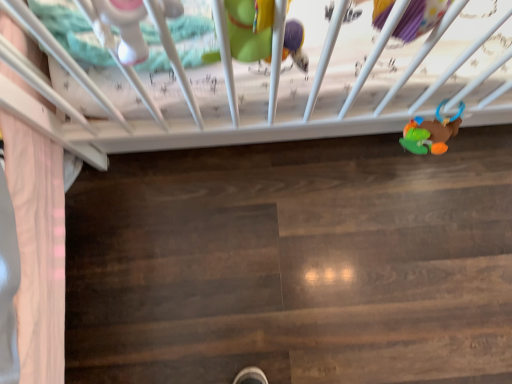
You are a GUI agent. You are given a task and a screenshot of the screen. Output one action in this format:
    pyautogui.click(x=<x>, y=<y>)
    Task: Click on the matte plastic rattle at upper left, the 3th toy in the back-to-front sequence
    The image size is (512, 384).
    Given the screenshot: What is the action you would take?
    pyautogui.click(x=119, y=26)

Measure the distance between matte green plush toy at upper center, which is the second toy from front to back, and camera.

They are 20.21 inches apart.

Identify the location of matte plastic rattle at upper left, the third toy when ordered from right to left. Image resolution: width=512 pixels, height=384 pixels. 119,26.

Is point (267, 23) behind point (113, 41)?

That is False.

Can you confirm if matte green plush toy at upper center, arranged as the 2th toy when viewed from the left, is smaller than matte plastic rattle at upper left, the 3th toy in the back-to-front sequence?

No, matte green plush toy at upper center, arranged as the 2th toy when viewed from the left, is not smaller than matte plastic rattle at upper left, the 3th toy in the back-to-front sequence.

From the image's perspective, relative to matte plastic rattle at upper left, the third toy when ordered from right to left, is matte green plush toy at upper center, arranged as the 2th toy when viewed from the left, above or below?

Based on their image positions, matte green plush toy at upper center, arranged as the 2th toy when viewed from the left, is located above matte plastic rattle at upper left, the third toy when ordered from right to left.

Is matte green plush toy at upper center, which is the second toy from front to back, shorter than matte plastic rattle at upper left, the 3th toy in the back-to-front sequence?

No.

Is matte plastic rattle at upper left, acting as the first toy starting from the left, thinner than rubberized plastic rattle at lower right, the 1th toy viewed from the right?

Correct, the width of matte plastic rattle at upper left, acting as the first toy starting from the left, is less than that of rubberized plastic rattle at lower right, the 1th toy viewed from the right.

Does matte plastic rattle at upper left, the third toy when ordered from right to left, have a larger size compared to rubberized plastic rattle at lower right, the first toy from the back?

No.

From the image's perspective, starting from the rubberized plastic rattle at lower right, the first toy from the back, which toy is the 1st one above? Please provide its 2D coordinates.

[(119, 26)]

Is rubberized plastic rattle at lower right, the first toy from the back, in contact with matte plastic rattle at upper left, the 3th toy in the back-to-front sequence?

There is a gap between rubberized plastic rattle at lower right, the first toy from the back, and matte plastic rattle at upper left, the 3th toy in the back-to-front sequence.

Which is closer to the camera, (445,147) or (173,5)?

Point (445,147) is positioned farther from the camera compared to point (173,5).

From a real-world perspective, between rubberized plastic rattle at lower right, marked as the third toy in a left-to-right arrangement, and matte plastic rattle at upper left, acting as the first toy starting from the left, who is vertically higher?

matte plastic rattle at upper left, acting as the first toy starting from the left.

Is rubberized plastic rattle at lower right, the third toy in the front-to-back sequence, completely or partially outside of matte plastic rattle at upper left, which is the first toy in front-to-back order?

Indeed, rubberized plastic rattle at lower right, the third toy in the front-to-back sequence, is completely outside matte plastic rattle at upper left, which is the first toy in front-to-back order.

Does rubberized plastic rattle at lower right, marked as the third toy in a left-to-right arrangement, have a lesser width compared to matte green plush toy at upper center, which is the second toy from front to back?

No, rubberized plastic rattle at lower right, marked as the third toy in a left-to-right arrangement, is not thinner than matte green plush toy at upper center, which is the second toy from front to back.

Is matte green plush toy at upper center, which ranks as the second toy in back-to-front order, at the back of rubberized plastic rattle at lower right, the third toy in the front-to-back sequence?

rubberized plastic rattle at lower right, the third toy in the front-to-back sequence, does not have its back to matte green plush toy at upper center, which ranks as the second toy in back-to-front order.

Is rubberized plastic rattle at lower right, the first toy from the back, to the right of matte green plush toy at upper center, which ranks as the second toy in right-to-left order, from the viewer's perspective?

Correct, you'll find rubberized plastic rattle at lower right, the first toy from the back, to the right of matte green plush toy at upper center, which ranks as the second toy in right-to-left order.

From the image's perspective, is rubberized plastic rattle at lower right, marked as the third toy in a left-to-right arrangement, above or below matte green plush toy at upper center, which ranks as the second toy in right-to-left order?

rubberized plastic rattle at lower right, marked as the third toy in a left-to-right arrangement, is below matte green plush toy at upper center, which ranks as the second toy in right-to-left order.

How far apart are matte green plush toy at upper center, which is the second toy from front to back, and rubberized plastic rattle at lower right, the 1th toy viewed from the right?

They are 16.34 inches apart.

Is matte green plush toy at upper center, which ranks as the second toy in back-to-front order, next to rubberized plastic rattle at lower right, the third toy in the front-to-back sequence?

No, matte green plush toy at upper center, which ranks as the second toy in back-to-front order, is not in contact with rubberized plastic rattle at lower right, the third toy in the front-to-back sequence.

Is rubberized plastic rattle at lower right, the first toy from the back, at the back of matte green plush toy at upper center, arranged as the 2th toy when viewed from the left?

No, matte green plush toy at upper center, arranged as the 2th toy when viewed from the left,'s orientation is not away from rubberized plastic rattle at lower right, the first toy from the back.

Which object is more forward, matte green plush toy at upper center, which is the second toy from front to back, or rubberized plastic rattle at lower right, the third toy in the front-to-back sequence?

matte green plush toy at upper center, which is the second toy from front to back, is closer to the camera.

From the image's perspective, is matte plastic rattle at upper left, which is the first toy in front-to-back order, located beneath matte green plush toy at upper center, which ranks as the second toy in back-to-front order?

Correct, matte plastic rattle at upper left, which is the first toy in front-to-back order, appears lower than matte green plush toy at upper center, which ranks as the second toy in back-to-front order, in the image.

In the scene shown: From a real-world perspective, is matte plastic rattle at upper left, which is the first toy in front-to-back order, beneath matte green plush toy at upper center, arranged as the 2th toy when viewed from the left?

Actually, matte plastic rattle at upper left, which is the first toy in front-to-back order, is physically above matte green plush toy at upper center, arranged as the 2th toy when viewed from the left, in the real world.

Find the location of `the 1st toy directly beneath the matte plastic rattle at upper left, acting as the first toy starting from the left (from a real-world perspective)`. the 1st toy directly beneath the matte plastic rattle at upper left, acting as the first toy starting from the left (from a real-world perspective) is located at coordinates (250, 29).

Would you consider matte plastic rattle at upper left, the third toy when ordered from right to left, to be distant from matte green plush toy at upper center, which ranks as the second toy in right-to-left order?

Actually, matte plastic rattle at upper left, the third toy when ordered from right to left, and matte green plush toy at upper center, which ranks as the second toy in right-to-left order, are a little close together.

There is a matte green plush toy at upper center, which ranks as the second toy in right-to-left order. Identify the location of the 1st toy below it (from the image's perspective). (119, 26).

This screenshot has width=512, height=384. In order to click on the 2nd toy counting from the right side of the matte plastic rattle at upper left, acting as the first toy starting from the left in this screenshot , I will do `click(431, 132)`.

Looking at this image, considering their positions, is matte green plush toy at upper center, arranged as the 2th toy when viewed from the left, positioned further to matte plastic rattle at upper left, the 3th toy in the back-to-front sequence, than rubberized plastic rattle at lower right, the first toy from the back?

rubberized plastic rattle at lower right, the first toy from the back.

Looking at the image, which one is located further to rubberized plastic rattle at lower right, the third toy in the front-to-back sequence, matte green plush toy at upper center, which ranks as the second toy in back-to-front order, or matte plastic rattle at upper left, the third toy when ordered from right to left?

Among the two, matte plastic rattle at upper left, the third toy when ordered from right to left, is located further to rubberized plastic rattle at lower right, the third toy in the front-to-back sequence.

From the image, which object appears to be farther from rubberized plastic rattle at lower right, the third toy in the front-to-back sequence, matte plastic rattle at upper left, which is the first toy in front-to-back order, or matte green plush toy at upper center, which ranks as the second toy in back-to-front order?

The object further to rubberized plastic rattle at lower right, the third toy in the front-to-back sequence, is matte plastic rattle at upper left, which is the first toy in front-to-back order.

Consider the image. Which object lies further to the anchor point matte plastic rattle at upper left, the third toy when ordered from right to left, rubberized plastic rattle at lower right, the 1th toy viewed from the right, or matte green plush toy at upper center, which ranks as the second toy in right-to-left order?

Among the two, rubberized plastic rattle at lower right, the 1th toy viewed from the right, is located further to matte plastic rattle at upper left, the third toy when ordered from right to left.

Considering their positions, is rubberized plastic rattle at lower right, the first toy from the back, positioned closer to matte green plush toy at upper center, which ranks as the second toy in right-to-left order, than matte plastic rattle at upper left, the third toy when ordered from right to left?

Among the two, matte plastic rattle at upper left, the third toy when ordered from right to left, is located nearer to matte green plush toy at upper center, which ranks as the second toy in right-to-left order.

Considering their positions, is matte plastic rattle at upper left, acting as the first toy starting from the left, positioned closer to matte green plush toy at upper center, which is the second toy from front to back, than rubberized plastic rattle at lower right, marked as the third toy in a left-to-right arrangement?

The object closer to matte green plush toy at upper center, which is the second toy from front to back, is matte plastic rattle at upper left, acting as the first toy starting from the left.

Locate an element on the screen. toy between matte plastic rattle at upper left, which is the first toy in front-to-back order, and rubberized plastic rattle at lower right, the first toy from the back, along the z-axis is located at coordinates (250, 29).